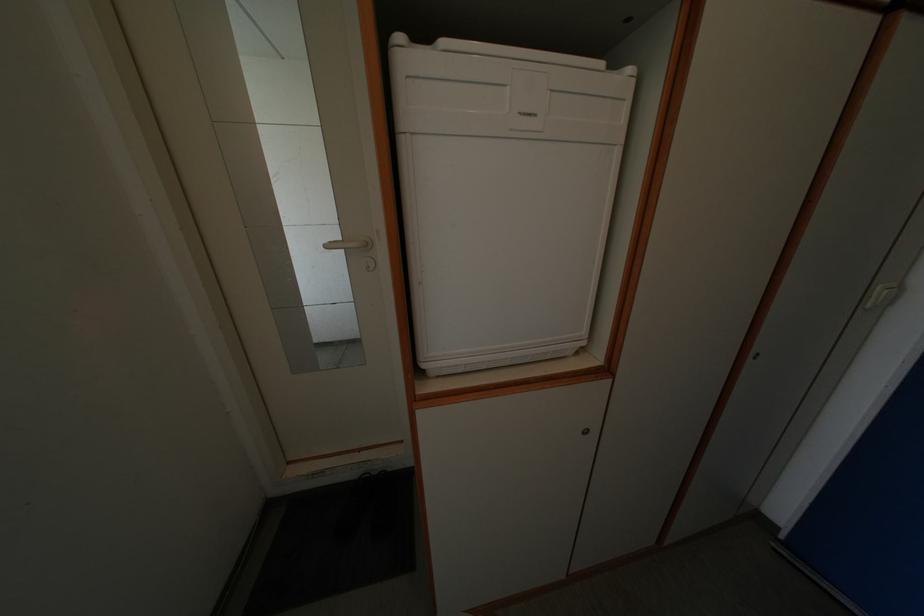
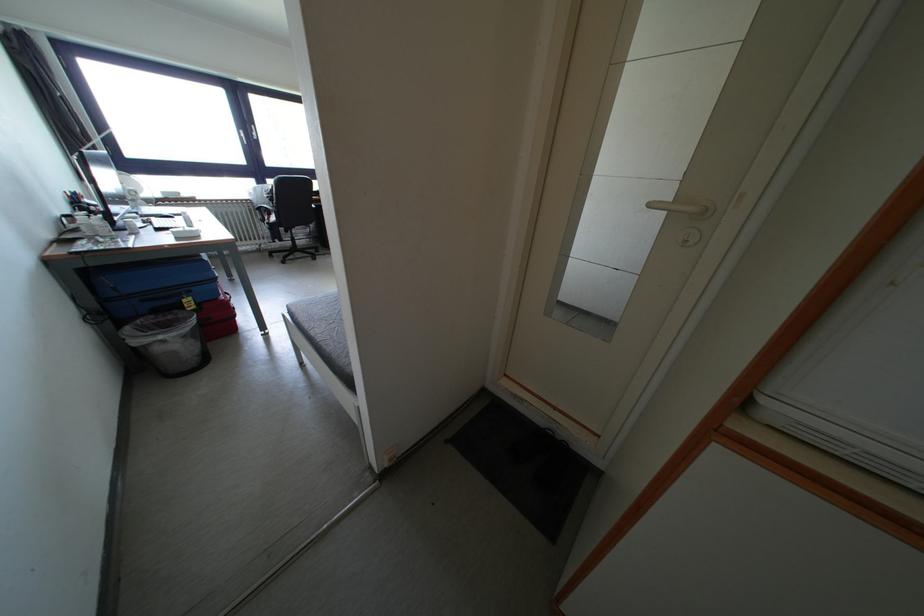
How did the camera likely rotate?

The camera's rotation is toward left-down.